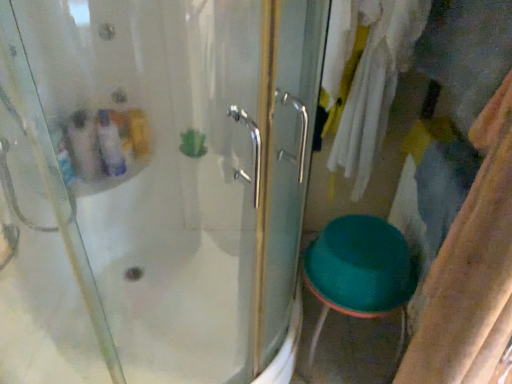
Question: Can you confirm if teal plastic stool at lower right is shorter than green plastic stool at lower right?

Choices:
 (A) yes
 (B) no

Answer: (A)

Question: From the image's perspective, is teal plastic stool at lower right on top of green plastic stool at lower right?

Choices:
 (A) no
 (B) yes

Answer: (A)

Question: Could you tell me if teal plastic stool at lower right is turned towards green plastic stool at lower right?

Choices:
 (A) no
 (B) yes

Answer: (A)

Question: Considering the relative sizes of teal plastic stool at lower right and green plastic stool at lower right in the image provided, is teal plastic stool at lower right smaller than green plastic stool at lower right?

Choices:
 (A) yes
 (B) no

Answer: (A)

Question: Is teal plastic stool at lower right taller than green plastic stool at lower right?

Choices:
 (A) no
 (B) yes

Answer: (A)

Question: Does teal plastic stool at lower right lie in front of green plastic stool at lower right?

Choices:
 (A) no
 (B) yes

Answer: (A)

Question: Does green plastic stool at lower right come behind teal plastic stool at lower right?

Choices:
 (A) no
 (B) yes

Answer: (A)

Question: From a real-world perspective, is green plastic stool at lower right on teal plastic stool at lower right?

Choices:
 (A) yes
 (B) no

Answer: (A)

Question: Is green plastic stool at lower right not within teal plastic stool at lower right?

Choices:
 (A) no
 (B) yes

Answer: (B)

Question: Are green plastic stool at lower right and teal plastic stool at lower right beside each other?

Choices:
 (A) yes
 (B) no

Answer: (B)

Question: Considering the relative positions of green plastic stool at lower right and teal plastic stool at lower right in the image provided, is green plastic stool at lower right to the right of teal plastic stool at lower right from the viewer's perspective?

Choices:
 (A) no
 (B) yes

Answer: (A)

Question: From a real-world perspective, is green plastic stool at lower right beneath teal plastic stool at lower right?

Choices:
 (A) yes
 (B) no

Answer: (B)

Question: Is green plastic stool at lower right to the left or to the right of teal plastic stool at lower right in the image?

Choices:
 (A) right
 (B) left

Answer: (B)